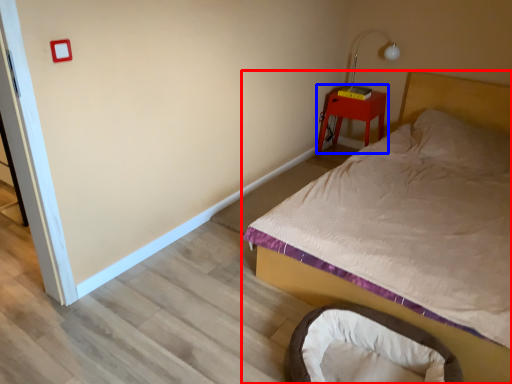
Question: Which point is further to the camera, bed (highlighted by a red box) or nightstand (highlighted by a blue box)?

Choices:
 (A) bed
 (B) nightstand

Answer: (B)